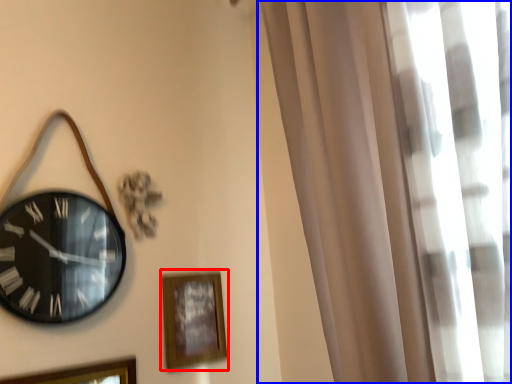
Question: Which of the following is the farthest to the observer, picture frame (highlighted by a red box) or curtain (highlighted by a blue box)?

Choices:
 (A) picture frame
 (B) curtain

Answer: (A)